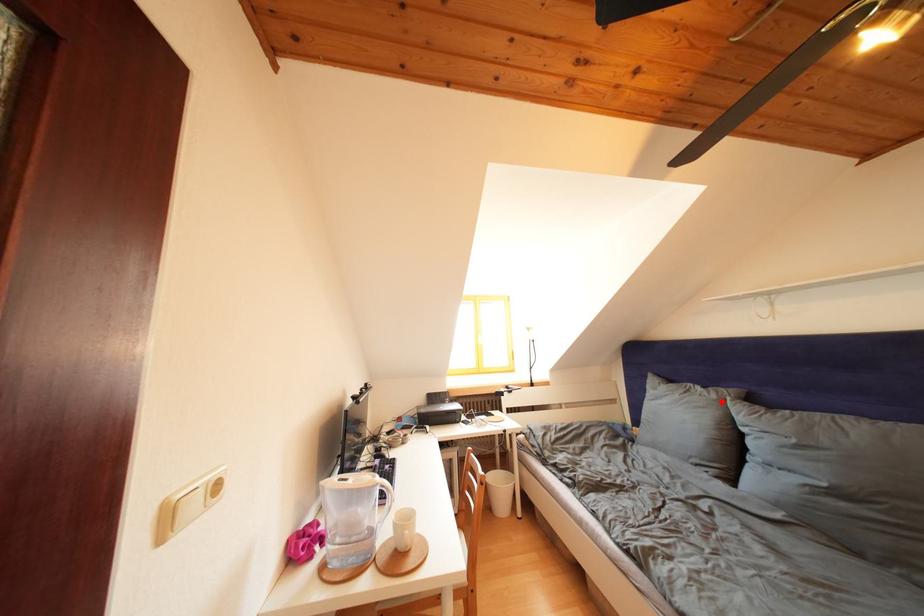
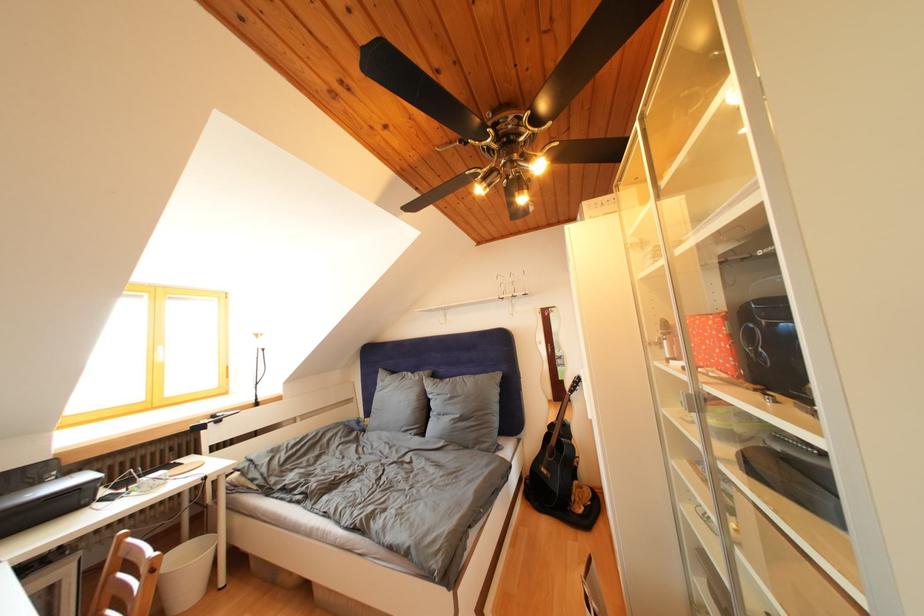
Question: I am providing you with two images of the same scene from different viewpoints. A red point is marked on the first image. Can you still see the location of the red point in image 2?

Choices:
 (A) Yes
 (B) No

Answer: (A)